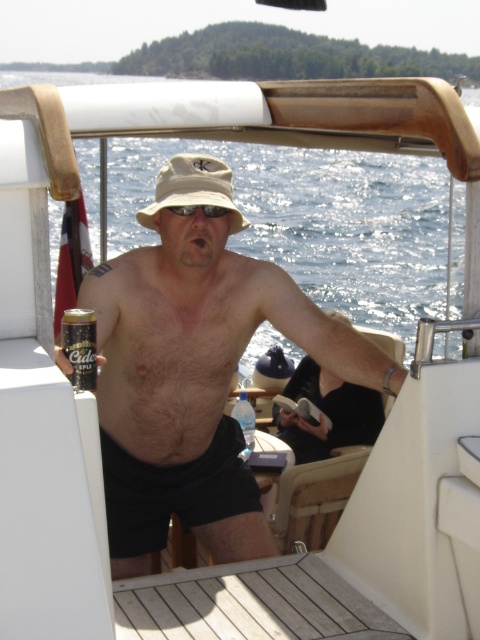
Question: Estimate the real-world distances between objects in this image. Which object is closer to the beige fabric hat at center?

Choices:
 (A) black cotton shorts at center
 (B) sunglasses at center
 (C) gold metallic can at lower left

Answer: (B)

Question: Is gold metallic can at lower left above sunglasses at center?

Choices:
 (A) no
 (B) yes

Answer: (A)

Question: Which object is positioned closest to the gold metallic can at lower left?

Choices:
 (A) beige fabric hat at center
 (B) matte beige bucket hat at center
 (C) hairy skin at center
 (D) black cotton shorts at center

Answer: (C)

Question: Does hairy skin at center have a smaller size compared to gold metallic can at lower left?

Choices:
 (A) yes
 (B) no

Answer: (B)

Question: Is the position of black cotton shorts at center more distant than that of gold metallic can at lower left?

Choices:
 (A) no
 (B) yes

Answer: (B)

Question: Which of the following is the farthest from the observer?

Choices:
 (A) black cotton shorts at center
 (B) sunglasses at center

Answer: (A)